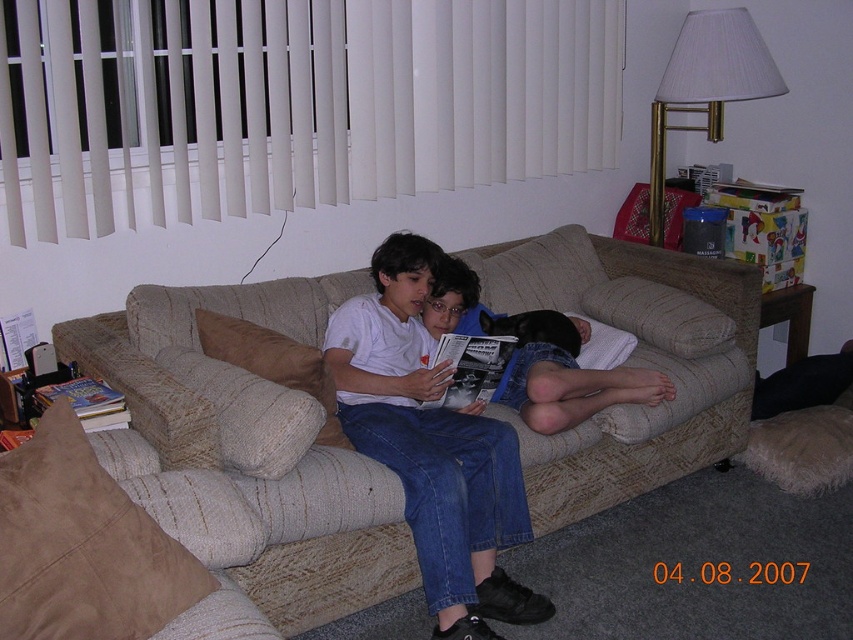
Does point (691, 342) come farther from viewer compared to point (498, 340)?

Yes, point (691, 342) is behind point (498, 340).

Is beige fabric couch at center closer to the viewer compared to black glossy magazine at center?

Yes, it is.

Which is behind, point (328, 541) or point (433, 401)?

The point (433, 401) is behind.

I want to click on beige fabric couch at center, so click(x=248, y=449).

From the picture: Does white vertical blinds at upper center have a lesser height compared to matte white shirt at center?

Correct, white vertical blinds at upper center is not as tall as matte white shirt at center.

Which is behind, point (480, 157) or point (490, 570)?

The point (480, 157) is more distant.

Between point (33, 40) and point (498, 445), which one is positioned in front?

Point (33, 40) is in front.

Locate an element on the screen. white vertical blinds at upper center is located at coordinates (376, 99).

Does gold metallic lampshade at upper right have a lesser height compared to black glossy magazine at center?

Incorrect, gold metallic lampshade at upper right's height does not fall short of black glossy magazine at center's.

Does point (727, 49) come farther from viewer compared to point (445, 392)?

Yes, point (727, 49) is farther from viewer.

What are the coordinates of `gold metallic lampshade at upper right` in the screenshot? It's located at (706, 86).